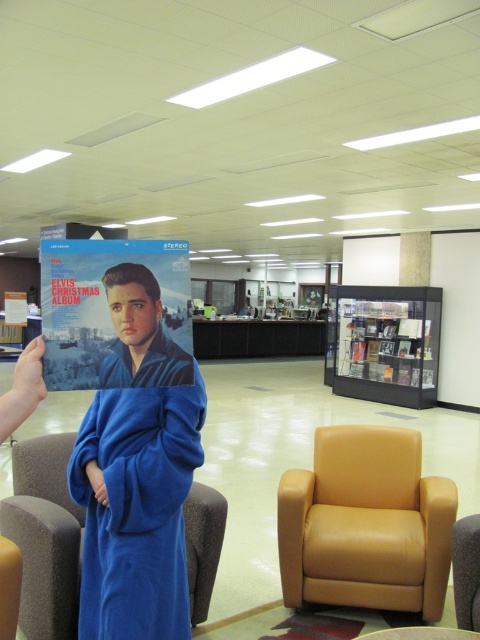
You are organizing a Christmas event and need to place the blue fleece robe at center and the matte blue vinyl record at left on a shelf. Which item should be placed higher to ensure the vinyl record is visible?

The matte blue vinyl record at left should be placed higher than the blue fleece robe at center since the blue fleece robe at center is positioned below it.